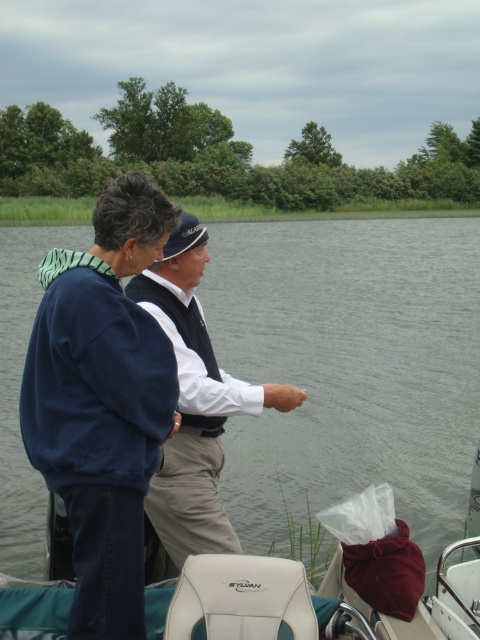
Can you confirm if clear water at center is positioned above white cotton shirt at center?

Yes, clear water at center is above white cotton shirt at center.

Locate an element on the screen. clear water at center is located at coordinates (349, 365).

This screenshot has width=480, height=640. What are the coordinates of `clear water at center` in the screenshot? It's located at (349, 365).

The height and width of the screenshot is (640, 480). In order to click on clear water at center in this screenshot , I will do `click(349, 365)`.

Which is in front, point (35, 499) or point (112, 461)?

Point (112, 461) is in front.

At what (x,y) coordinates should I click in order to perform the action: click on clear water at center. Please return your answer as a coordinate pair (x, y). Image resolution: width=480 pixels, height=640 pixels. Looking at the image, I should click on (349, 365).

Who is more distant from viewer, (118,218) or (178,269)?

Positioned behind is point (178,269).

Can you confirm if navy blue sweatshirt at center is thinner than white cotton shirt at center?

Indeed, navy blue sweatshirt at center has a lesser width compared to white cotton shirt at center.

Who is more distant from viewer, (x=129, y=356) or (x=187, y=397)?

The point (x=187, y=397) is more distant.

Where is `navy blue sweatshirt at center`? The height and width of the screenshot is (640, 480). navy blue sweatshirt at center is located at coordinates (103, 401).